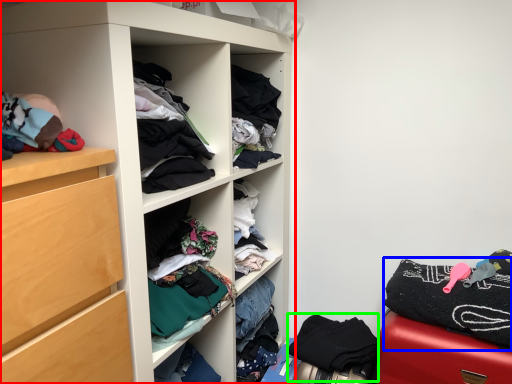
Question: Based on their relative distances, which object is farther from cupboard (highlighted by a red box)? Choose from clothing (highlighted by a blue box) and clothing (highlighted by a green box).

Choices:
 (A) clothing
 (B) clothing

Answer: (A)